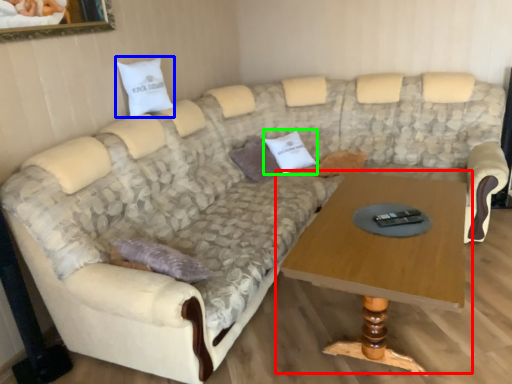
Question: Estimate the real-world distances between objects in this image. Which object is closer to coffee table (highlighted by a red box), pillow (highlighted by a blue box) or pillow (highlighted by a green box)?

Choices:
 (A) pillow
 (B) pillow

Answer: (B)